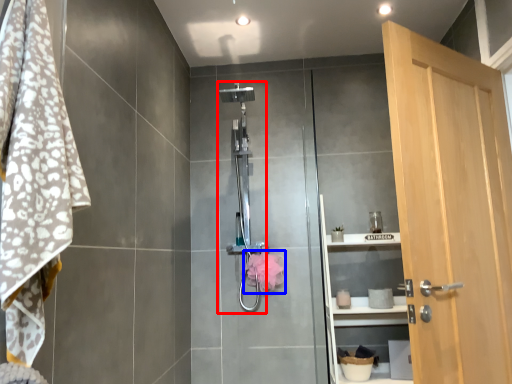
Question: Which of the following is the closest to the observer, shower (highlighted by a red box) or hand towel (highlighted by a blue box)?

Choices:
 (A) shower
 (B) hand towel

Answer: (A)